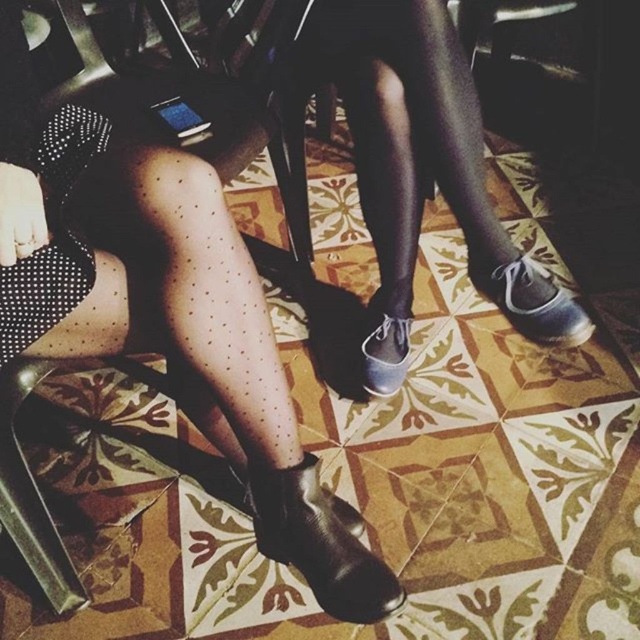
You are a tailor measuring fabric for a new pair of matte black tights at center and a matte black shoe at lower center. Which item requires more fabric based on their widths?

The matte black tights at center require more fabric because their width surpasses that of the matte black shoe at lower center.

You are standing at the point marked as point (410,152) and want to walk directly towards the viewer. How far will you have to walk to reach the viewer?

The distance between point (410,152) and the viewer is 1.25 meters, so you would have to walk 1.25 meters to reach the viewer.

You are a photographer trying to capture both the matte black shoe at lower center and the white leather shoe at lower right in a single frame. Considering their heights, which shoe will appear larger in the photo?

The matte black shoe at lower center will appear larger in the photo because it is much taller than the white leather shoe at lower right.